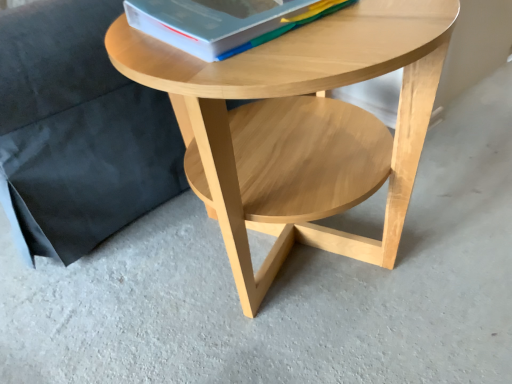
Question: Is hardcover book at upper center at the right side of natural wood coffee table at center?

Choices:
 (A) yes
 (B) no

Answer: (B)

Question: From a real-world perspective, is hardcover book at upper center on natural wood coffee table at center?

Choices:
 (A) no
 (B) yes

Answer: (B)

Question: Is hardcover book at upper center thinner than natural wood coffee table at center?

Choices:
 (A) yes
 (B) no

Answer: (A)

Question: Considering the relative sizes of hardcover book at upper center and natural wood coffee table at center in the image provided, is hardcover book at upper center bigger than natural wood coffee table at center?

Choices:
 (A) no
 (B) yes

Answer: (A)

Question: Is hardcover book at upper center looking in the opposite direction of natural wood coffee table at center?

Choices:
 (A) yes
 (B) no

Answer: (B)

Question: In the image, is matte wood armchair at upper left positioned in front of or behind hardcover book at upper center?

Choices:
 (A) behind
 (B) front

Answer: (A)

Question: Is matte wood armchair at upper left taller or shorter than hardcover book at upper center?

Choices:
 (A) short
 (B) tall

Answer: (B)

Question: Considering the positions of matte wood armchair at upper left and hardcover book at upper center in the image, is matte wood armchair at upper left wider or thinner than hardcover book at upper center?

Choices:
 (A) wide
 (B) thin

Answer: (A)

Question: Considering the relative positions of matte wood armchair at upper left and hardcover book at upper center in the image provided, is matte wood armchair at upper left to the left or to the right of hardcover book at upper center?

Choices:
 (A) right
 (B) left

Answer: (B)

Question: From a real-world perspective, is natural wood coffee table at center physically located above or below hardcover book at upper center?

Choices:
 (A) below
 (B) above

Answer: (A)

Question: From their relative heights in the image, would you say natural wood coffee table at center is taller or shorter than hardcover book at upper center?

Choices:
 (A) tall
 (B) short

Answer: (A)

Question: From the image's perspective, is natural wood coffee table at center positioned above or below hardcover book at upper center?

Choices:
 (A) below
 (B) above

Answer: (A)

Question: Is natural wood coffee table at center in front of or behind hardcover book at upper center in the image?

Choices:
 (A) front
 (B) behind

Answer: (A)

Question: Is point (142, 99) positioned closer to the camera than point (310, 29)?

Choices:
 (A) closer
 (B) farther

Answer: (B)

Question: Visually, is matte wood armchair at upper left positioned to the left or to the right of natural wood coffee table at center?

Choices:
 (A) left
 (B) right

Answer: (A)